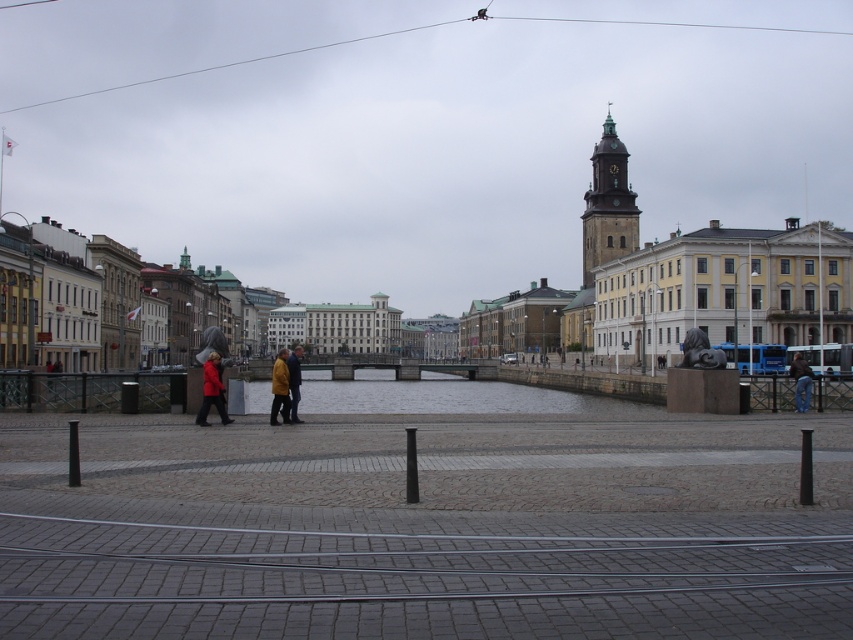
Question: Can you confirm if yellow matte jacket at center is wider than matte red coat at center?

Choices:
 (A) yes
 (B) no

Answer: (A)

Question: Which of the following is the farthest from the observer?

Choices:
 (A) matte red coat at center
 (B) golden stone tower at upper right
 (C) jeans at lower right
 (D) clear water at center

Answer: (B)

Question: Which of the following is the farthest from the observer?

Choices:
 (A) (221, 417)
 (B) (291, 420)

Answer: (B)

Question: Can you confirm if yellow matte jacket at center is positioned above matte red coat at center?

Choices:
 (A) yes
 (B) no

Answer: (B)

Question: Estimate the real-world distances between objects in this image. Which object is farther from the golden stone tower at upper right?

Choices:
 (A) yellow leather jacket at center
 (B) jeans at lower right

Answer: (A)

Question: In this image, where is golden stone tower at upper right located relative to yellow leather jacket at center?

Choices:
 (A) above
 (B) below

Answer: (A)